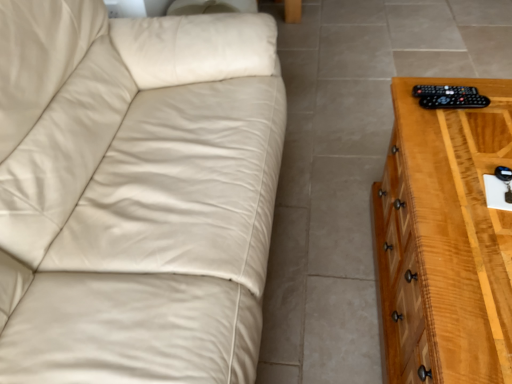
Find the location of a particular element. vacant space to the right of black plastic remote at right is located at coordinates (489, 95).